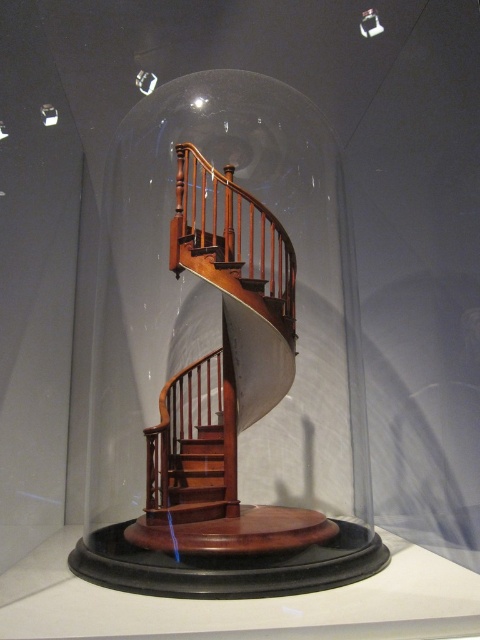
You are standing in front of the spiral staircase inside the transparent glass dome. If you move directly towards the point with coordinates (227, 353), will you be facing the base of the staircase or the top of the dome?

The point (227, 353) corresponds to the transparent glass dome at center, so moving directly towards it would lead you to the center of the dome, which is where the base of the staircase is located. Therefore, you would be facing the base of the staircase.

You are an interior designer planning to place a new decorative item in the center of the room. The item is 1.2 meters wide. You see the transparent glass dome at center and the mahogany wood stairs at center. Will the new item fit between them without touching either?

The transparent glass dome at center is wider than the mahogany wood stairs at center. Since the new item is 1.2 meters wide, it might not fit between them if the distance between the edges of the dome and stairs is less than 1.2 meters. However, the exact placement depends on their specific positions and spacing, which isn not provided in the description.

You are standing in front of the spiral staircase inside the glass dome. Where is the mahogany wood railing at center located in terms of its 2D coordinates?

The mahogany wood railing at center is located at the 2D coordinates of point (231, 241).